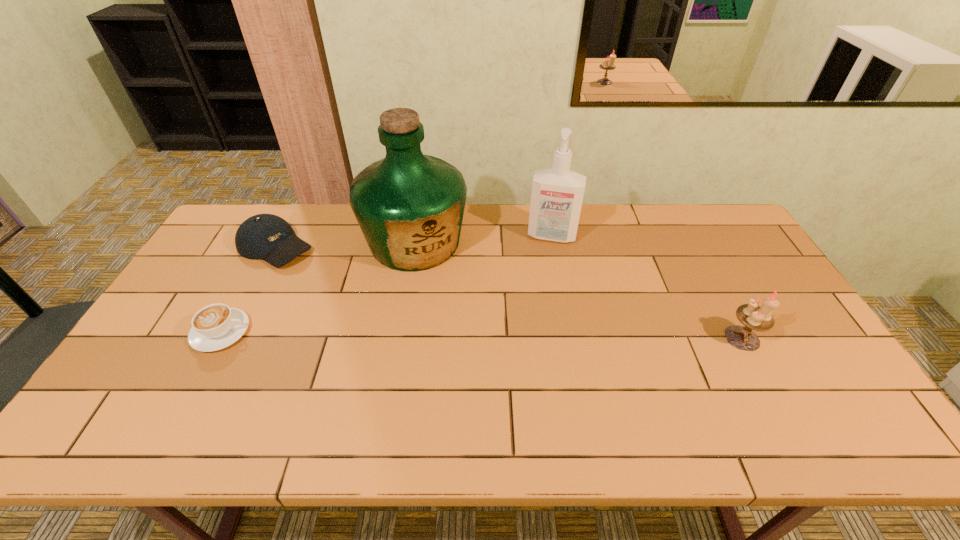
Locate an element on the screen. vacant point located between the third shortest object and the cleansing agent is located at coordinates (647, 287).

Locate an element on the screen. The width and height of the screenshot is (960, 540). object that stands as the fourth closest to the shortest object is located at coordinates (753, 317).

I want to click on object that is the second closest to the third tallest object, so click(409, 206).

Identify the location of free space that satisfies the following two spatial constraints: 1. on the back side of the baseball cap; 2. on the left side of the cleansing agent. The width and height of the screenshot is (960, 540). (280, 236).

This screenshot has height=540, width=960. Identify the location of vacant region that satisfies the following two spatial constraints: 1. on the front side of the third shortest object; 2. on the left side of the fourth object from left to right. [571, 338].